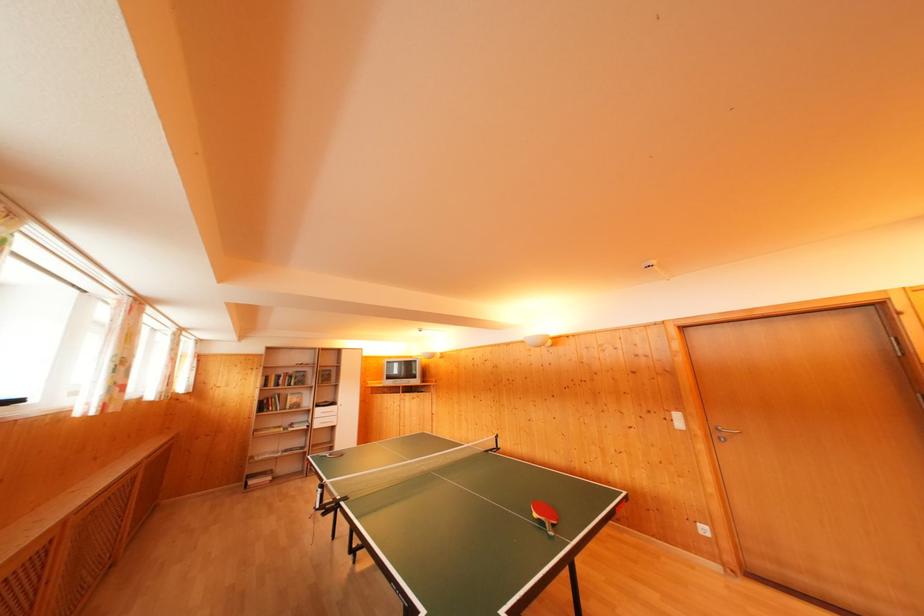
Where would you plugging into the white power outlet? Please return your answer as a coordinate pair (x, y).

(703, 530)